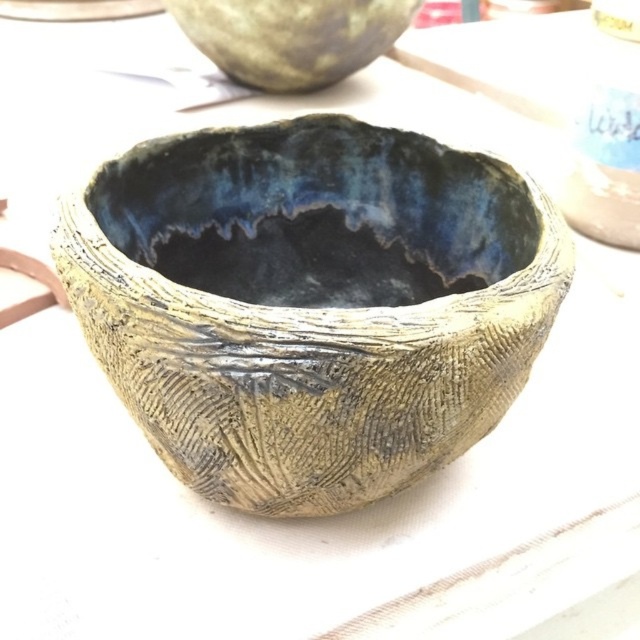
You are arranging bowls on a shelf and have the textured clay bowl at center and the matte ceramic bowl at upper center. Which bowl should you place to the left to maintain the arrangement shown?

The matte ceramic bowl at upper center should be placed to the left since the textured clay bowl at center is to the right of it in the original arrangement.

You are setting up a table for a dinner party and have both the textured clay bowl at center and the matte ceramic bowl at upper center. Which bowl should you choose if you want the one that can hold more food?

The textured clay bowl at center is larger in size than the matte ceramic bowl at upper center, so it can hold more food.

You are holding a camera and want to take a photo of both the textured clay bowl at center and the matte ceramic bowl at upper center. Which bowl should you focus on first to ensure both are in clear view?

You should focus on the textured clay bowl at center first since it is closer to the viewer than the matte ceramic bowl at upper center, ensuring both are in clear focus when properly adjusted.